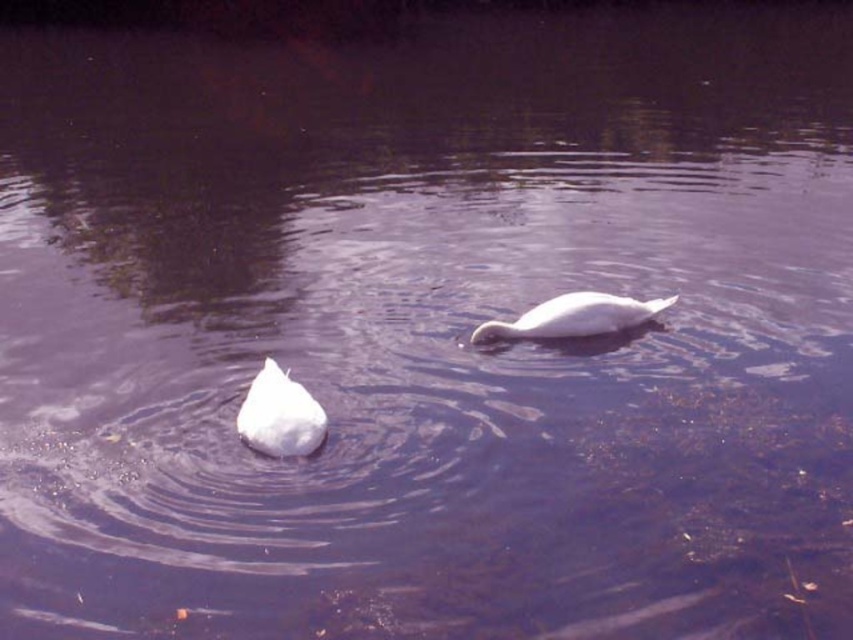
Question: Can you confirm if white matte swan at lower left is bigger than white glossy swan at center?

Choices:
 (A) no
 (B) yes

Answer: (A)

Question: Can you confirm if white matte swan at lower left is bigger than white glossy swan at center?

Choices:
 (A) yes
 (B) no

Answer: (B)

Question: Which point is farther to the camera?

Choices:
 (A) white glossy swan at center
 (B) white matte swan at lower left

Answer: (A)

Question: From the image, what is the correct spatial relationship of white matte swan at lower left in relation to white glossy swan at center?

Choices:
 (A) above
 (B) below

Answer: (B)

Question: Which object appears farthest from the camera in this image?

Choices:
 (A) white glossy swan at center
 (B) white matte swan at lower left

Answer: (A)